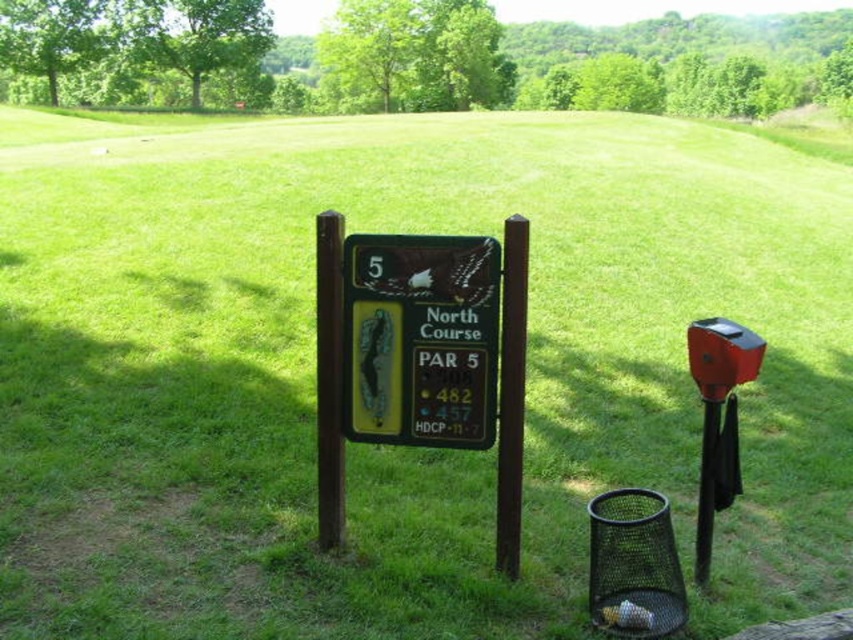
You are a golfer standing in front of the North Course sign. You notice two brown wooden structures supporting the sign. Which one is thinner, the brown wood pole at center or the brown polished wood post at center?

The brown wood pole at center is thinner than the brown polished wood post at center, as it has a lesser width according to the description.

In the scene shown: You are standing at the origin point of the golf course and want to place a new marker exactly 0.1 units to the right of the wooden sign at center. What are the coordinates of the new marker?

The wooden sign at center is located at point (421, 339). Adding 0.1 units to the x coordinate gives 0.631, so the new marker should be placed at coordinates (421, 403).

You are standing in the middle of the golf course and see the wooden sign at center and the brown wood pole at center. Which object is positioned to the left from your perspective?

The wooden sign at center is positioned to the left of the brown wood pole at center.